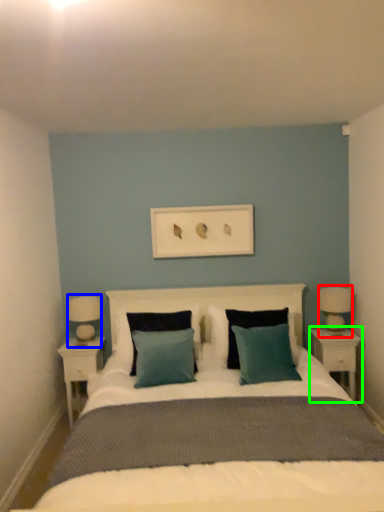
Question: Based on their relative distances, which object is farther from bedside lamp (highlighted by a red box)? Choose from table lamp (highlighted by a blue box) and nightstand (highlighted by a green box).

Choices:
 (A) table lamp
 (B) nightstand

Answer: (A)